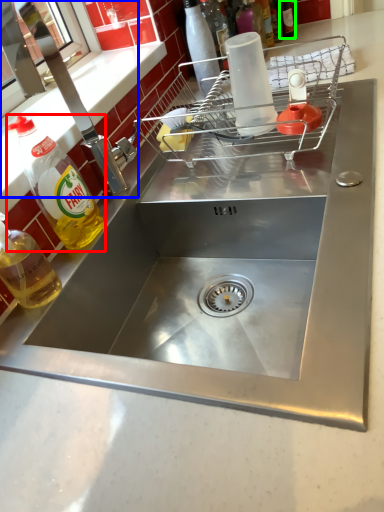
Question: Estimate the real-world distances between objects in this image. Which object is closer to bottle (highlighted by a red box), tap (highlighted by a blue box) or bottle (highlighted by a green box)?

Choices:
 (A) tap
 (B) bottle

Answer: (A)